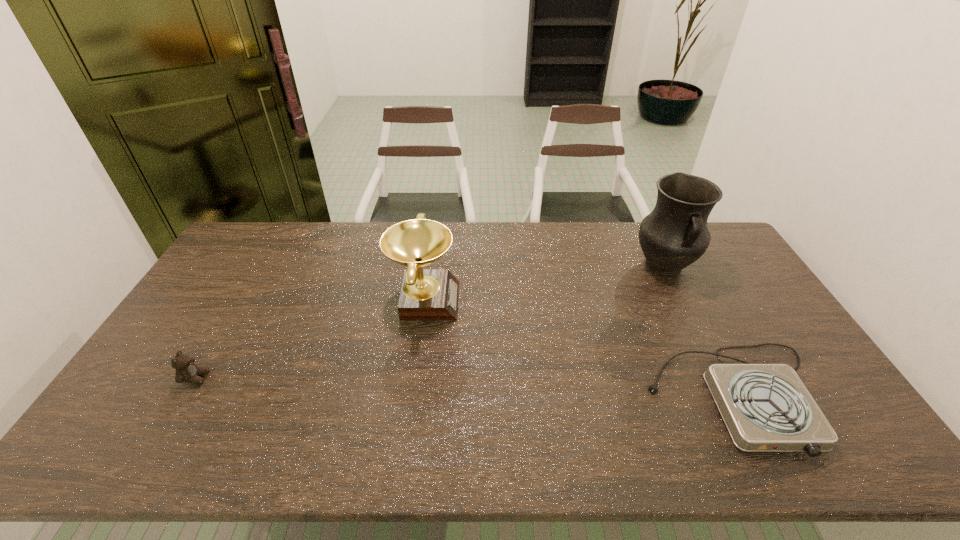
The height and width of the screenshot is (540, 960). What are the coordinates of `object at the near edge` in the screenshot? It's located at (766, 407).

Where is `object present at the left edge`? The image size is (960, 540). object present at the left edge is located at coordinates (186, 371).

Find the location of a particular element. The height and width of the screenshot is (540, 960). pitcher present at the right edge is located at coordinates (674, 235).

Where is `hotplate that is positioned at the right edge`? hotplate that is positioned at the right edge is located at coordinates (766, 407).

The image size is (960, 540). I want to click on object that is positioned at the far right corner, so [x=674, y=235].

This screenshot has height=540, width=960. I want to click on object at the near right corner, so click(766, 407).

What are the coordinates of `vacant area at the far edge of the desktop` in the screenshot? It's located at (542, 257).

This screenshot has width=960, height=540. In the image, there is a desktop. Find the location of `vacant space at the near edge`. vacant space at the near edge is located at coordinates (420, 460).

In order to click on vacant space at the left edge of the desktop in this screenshot , I will do `click(235, 314)`.

Where is `vacant point at the right edge`? vacant point at the right edge is located at coordinates (729, 268).